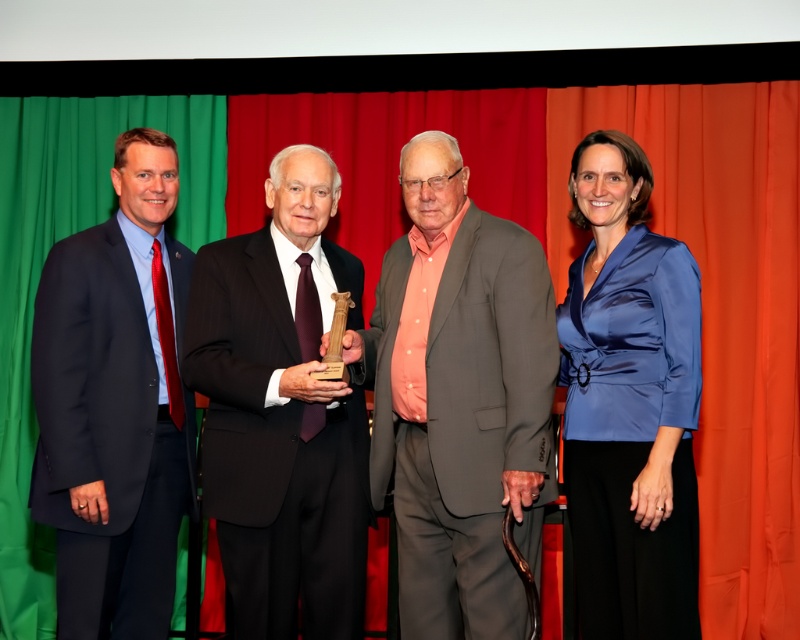
Looking at this image, is gray fabric suit at center to the right of navy blue suit at left from the viewer's perspective?

Yes, gray fabric suit at center is to the right of navy blue suit at left.

Between gray fabric suit at center and navy blue suit at left, which one appears on the left side from the viewer's perspective?

Positioned to the left is navy blue suit at left.

In order to click on gray fabric suit at center in this screenshot , I will do `click(458, 400)`.

Image resolution: width=800 pixels, height=640 pixels. What are the coordinates of `gray fabric suit at center` in the screenshot? It's located at (458, 400).

Which of these two, navy blue suit at left or satin blue blouse at right, stands taller?

navy blue suit at left

Does navy blue suit at left have a smaller size compared to satin blue blouse at right?

Actually, navy blue suit at left might be larger than satin blue blouse at right.

I want to click on navy blue suit at left, so click(x=114, y=403).

Does black pinstripe suit at center have a greater width compared to navy blue suit at left?

Indeed, black pinstripe suit at center has a greater width compared to navy blue suit at left.

Is the position of black pinstripe suit at center less distant than that of navy blue suit at left?

Yes, black pinstripe suit at center is in front of navy blue suit at left.

You are a GUI agent. You are given a task and a screenshot of the screen. Output one action in this format:
    pyautogui.click(x=<x>, y=<y>)
    Task: Click on the black pinstripe suit at center
    
    Given the screenshot: What is the action you would take?
    pyautogui.click(x=281, y=412)

Locate an element on the screen. Image resolution: width=800 pixels, height=640 pixels. black pinstripe suit at center is located at coordinates (281, 412).